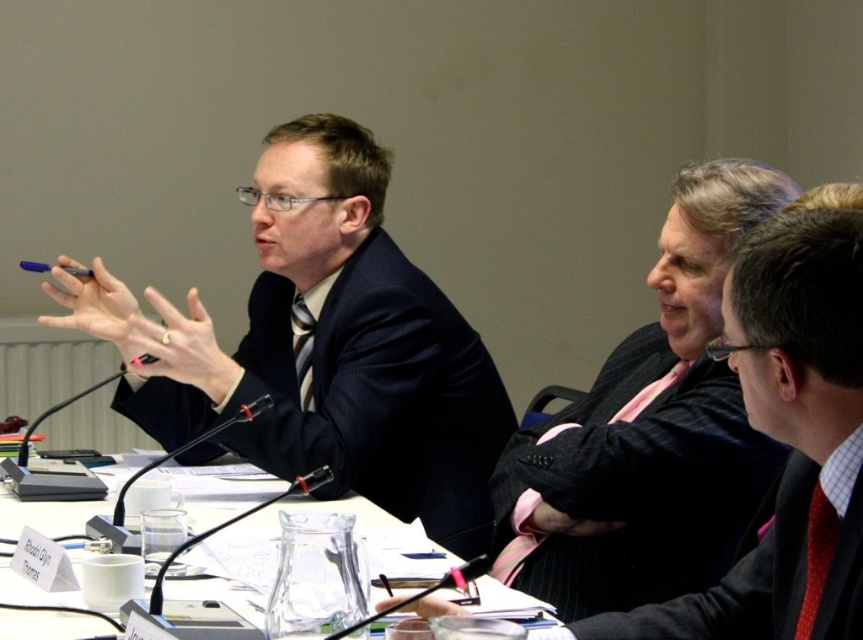
Question: Which of the following is the closest to the observer?

Choices:
 (A) (217, 637)
 (B) (344, 278)
 (C) (723, 440)

Answer: (A)

Question: Which of the following is the farthest from the observer?

Choices:
 (A) matte black suit at left
 (B) black pinstripe suit at right
 (C) pink striped tie at center

Answer: (A)

Question: Can you confirm if matte black suit at left is positioned to the right of clear glass table at center?

Choices:
 (A) yes
 (B) no

Answer: (B)

Question: Observing the image, what is the correct spatial positioning of black pinstripe suit at right in reference to clear glass table at center?

Choices:
 (A) above
 (B) below

Answer: (A)

Question: Where is pink striped tie at center located in relation to black pinstripe suit at right in the image?

Choices:
 (A) left
 (B) right

Answer: (A)

Question: Which object is closer to the camera taking this photo?

Choices:
 (A) clear glass table at center
 (B) matte black suit at left
 (C) pink striped tie at center

Answer: (A)